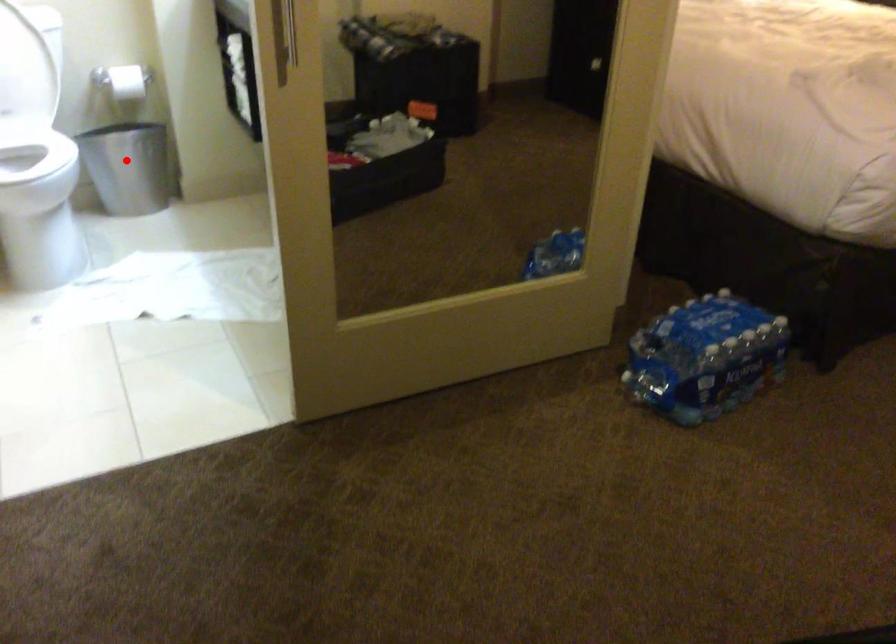
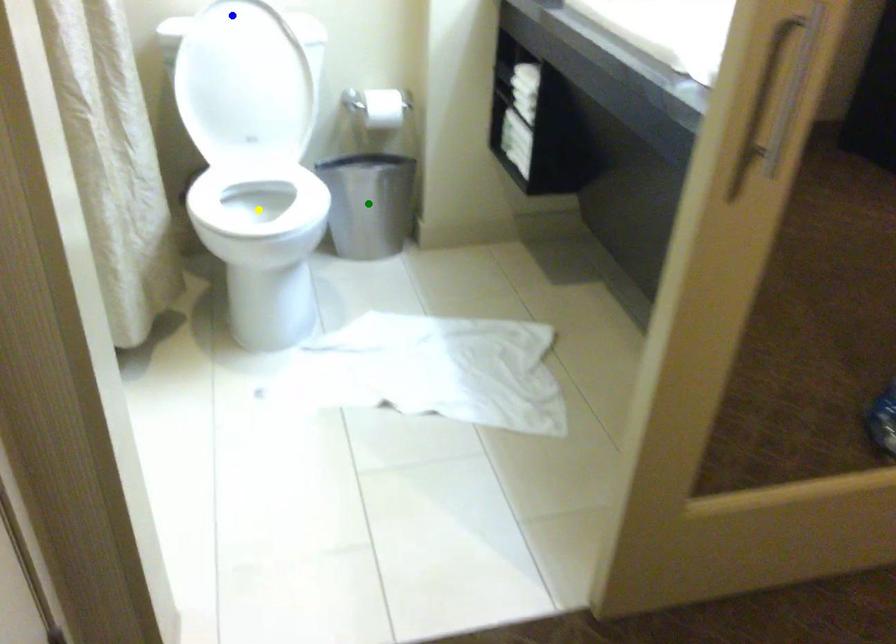
Question: I am providing you with two images of the same scene from different viewpoints. A red point is marked on the first image. You are given multiple points on the second image. Which spot in image 2 lines up with the point in image 1?

Choices:
 (A) blue point
 (B) green point
 (C) yellow point

Answer: (B)